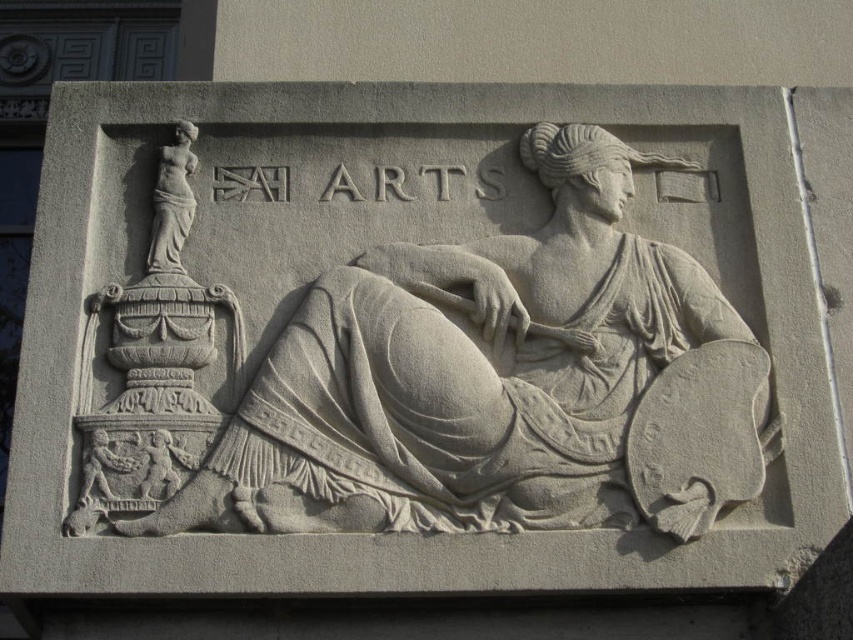
Does white stone sculpture at center have a lesser height compared to smooth white statue at upper left?

No, white stone sculpture at center is not shorter than smooth white statue at upper left.

Does white stone sculpture at center have a smaller size compared to smooth white statue at upper left?

Actually, white stone sculpture at center might be larger than smooth white statue at upper left.

The width and height of the screenshot is (853, 640). Find the location of `white stone sculpture at center`. white stone sculpture at center is located at coordinates (496, 381).

The width and height of the screenshot is (853, 640). I want to click on white stone sculpture at center, so click(x=496, y=381).